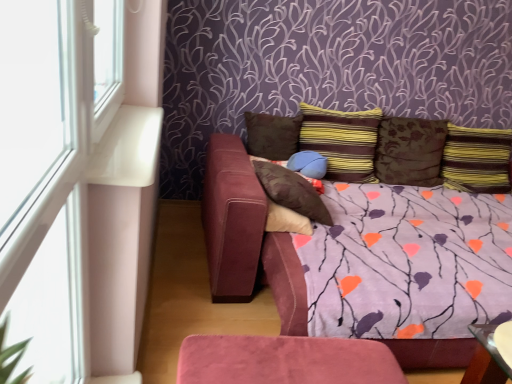
Question: Is velvet brown pillow at center, acting as the 5th pillow starting from the right, in front of or behind striped fabric pillow at center, arranged as the third pillow when viewed from the right, in the image?

Choices:
 (A) front
 (B) behind

Answer: (A)

Question: Considering the positions of velvet brown pillow at center, acting as the 5th pillow starting from the right, and striped fabric pillow at center, arranged as the third pillow when viewed from the right, in the image, is velvet brown pillow at center, acting as the 5th pillow starting from the right, wider or thinner than striped fabric pillow at center, arranged as the third pillow when viewed from the right,?

Choices:
 (A) thin
 (B) wide

Answer: (B)

Question: Which object is the farthest from the suede-like purple couch at center?

Choices:
 (A) white plastic window frame at left
 (B) striped fabric pillow at upper right, which is counted as the sixth pillow, starting from the left
 (C) brown floral pillow at center, placed as the 2th pillow when sorted from right to left
 (D) transparent glass table at lower right
 (E) brown suede pillow at center, the 6th pillow from the right

Answer: (A)

Question: Based on their relative distances, which object is farther from the suede-like purple couch at center?

Choices:
 (A) transparent glass table at lower right
 (B) striped fabric pillow at upper right, marked as the 1th pillow in a right-to-left arrangement
 (C) white plastic window frame at left
 (D) brown suede pillow at center, the 6th pillow from the right
 (E) striped fabric pillow at center, arranged as the third pillow when viewed from the right

Answer: (C)